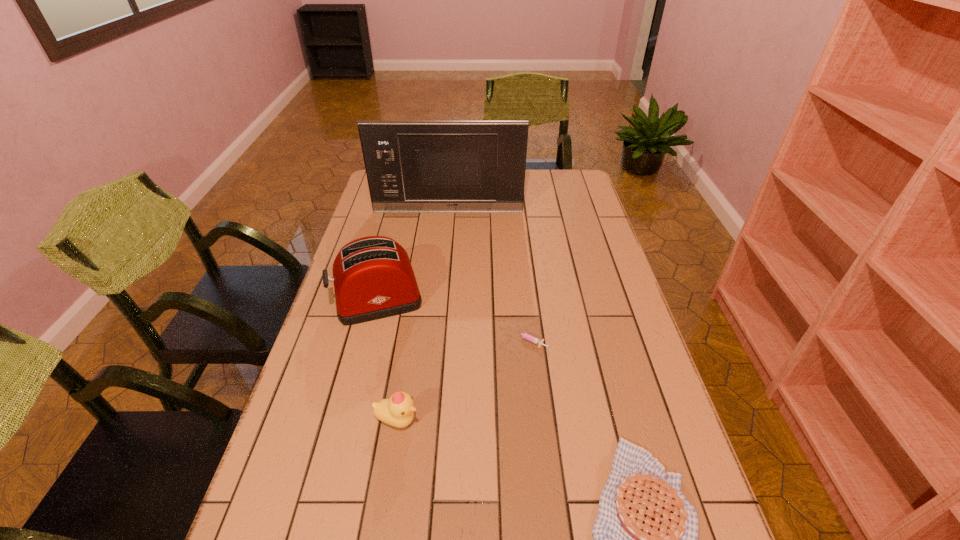
You are a GUI agent. You are given a task and a screenshot of the screen. Output one action in this format:
    pyautogui.click(x=<x>, y=<y>)
    Task: Click on the vacant space that's between the farthest object and the third tallest object
    
    Given the screenshot: What is the action you would take?
    pyautogui.click(x=422, y=316)

Identify the location of empty space that is in between the farthest object and the third farthest object. (488, 276).

Identify which object is the second nearest to the farthest object. Please provide its 2D coordinates. Your answer should be formatted as a tuple, i.e. [(x, y)], where the tuple contains the x and y coordinates of a point satisfying the conditions above.

[(526, 336)]

Locate an element on the screen. Image resolution: width=960 pixels, height=540 pixels. the closest object to the fourth tallest object is located at coordinates (526, 336).

I want to click on vacant space that satisfies the following two spatial constraints: 1. on the front side of the shortest object; 2. on the right side of the toaster, so point(368,340).